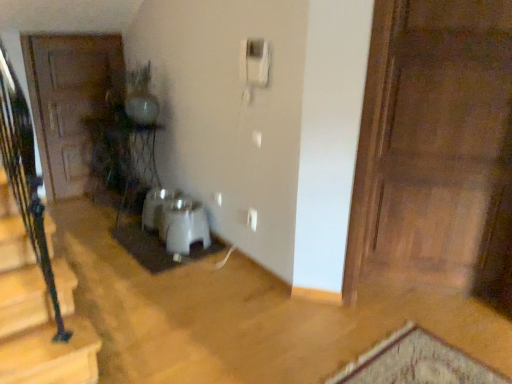
Question: From the image's perspective, is white matte doormat at center located beneath wooden door at right, which ranks as the 1th door in front-to-back order?

Choices:
 (A) no
 (B) yes

Answer: (B)

Question: From a real-world perspective, is white matte doormat at center located beneath wooden door at right, acting as the second door starting from the back?

Choices:
 (A) yes
 (B) no

Answer: (A)

Question: Does white matte doormat at center turn towards wooden door at right, which ranks as the 1th door in front-to-back order?

Choices:
 (A) no
 (B) yes

Answer: (A)

Question: Is white matte doormat at center smaller than wooden door at right, acting as the 1th door starting from the right?

Choices:
 (A) yes
 (B) no

Answer: (A)

Question: Can you confirm if white matte doormat at center is shorter than wooden door at right, acting as the 1th door starting from the right?

Choices:
 (A) yes
 (B) no

Answer: (A)

Question: In terms of width, does wooden door at right, acting as the 1th door starting from the right, look wider or thinner when compared to white plastic water heater at center?

Choices:
 (A) thin
 (B) wide

Answer: (A)

Question: Considering the positions of wooden door at right, acting as the second door starting from the back, and white plastic water heater at center in the image, is wooden door at right, acting as the second door starting from the back, taller or shorter than white plastic water heater at center?

Choices:
 (A) tall
 (B) short

Answer: (A)

Question: From a real-world perspective, relative to white plastic water heater at center, is wooden door at right, which ranks as the 1th door in front-to-back order, vertically above or below?

Choices:
 (A) above
 (B) below

Answer: (A)

Question: Would you say wooden door at right, which is the 2th door in left-to-right order, is inside or outside white plastic water heater at center?

Choices:
 (A) inside
 (B) outside

Answer: (B)

Question: Is white matte doormat at center spatially inside wooden door at left, which ranks as the first door in left-to-right order, or outside of it?

Choices:
 (A) inside
 (B) outside

Answer: (B)

Question: Considering the relative positions of white matte doormat at center and wooden door at left, which ranks as the first door in left-to-right order, in the image provided, is white matte doormat at center to the left or to the right of wooden door at left, which ranks as the first door in left-to-right order,?

Choices:
 (A) right
 (B) left

Answer: (A)

Question: From the image's perspective, is white matte doormat at center located above or below wooden door at left, which ranks as the first door in left-to-right order?

Choices:
 (A) below
 (B) above

Answer: (A)

Question: Is point (x=147, y=246) closer or farther from the camera than point (x=57, y=117)?

Choices:
 (A) farther
 (B) closer

Answer: (B)

Question: Choose the correct answer: Is white plastic water heater at center inside white plastic corded phone at upper center or outside it?

Choices:
 (A) inside
 (B) outside

Answer: (B)

Question: Is white plastic water heater at center in front of or behind white plastic corded phone at upper center in the image?

Choices:
 (A) behind
 (B) front

Answer: (A)